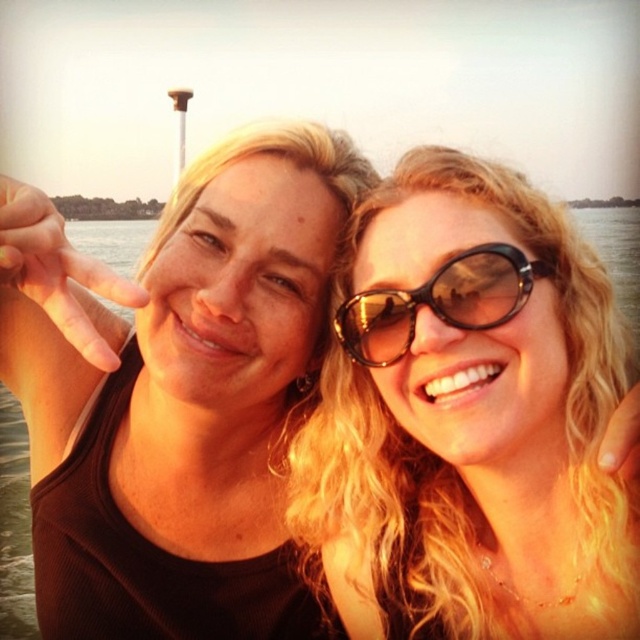
Question: Which object appears closest to the camera in this image?

Choices:
 (A) black plastic sunglasses at center
 (B) transparent water at center

Answer: (B)

Question: Can you confirm if transparent water at center is positioned to the left of black plastic sunglasses at center?

Choices:
 (A) yes
 (B) no

Answer: (A)

Question: Can you confirm if transparent water at center is smaller than black plastic sunglasses at center?

Choices:
 (A) yes
 (B) no

Answer: (B)

Question: Which point is farther from the camera taking this photo?

Choices:
 (A) (582, 227)
 (B) (378, 323)

Answer: (A)

Question: Is transparent water at center wider than black plastic sunglasses at center?

Choices:
 (A) no
 (B) yes

Answer: (B)